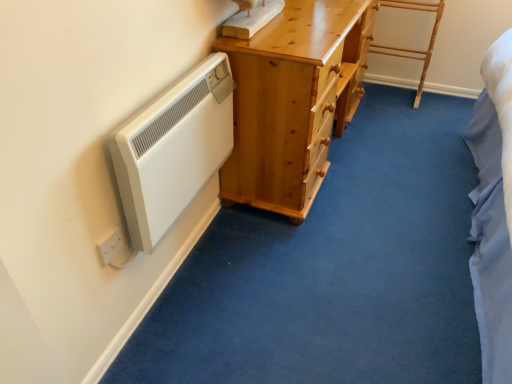
Question: Is light wood/rough textured ladder at upper right shorter than white matte radiator at left?

Choices:
 (A) yes
 (B) no

Answer: (B)

Question: From a real-world perspective, is light wood/rough textured ladder at upper right below white matte radiator at left?

Choices:
 (A) yes
 (B) no

Answer: (A)

Question: From a real-world perspective, is light wood/rough textured ladder at upper right on white matte radiator at left?

Choices:
 (A) yes
 (B) no

Answer: (B)

Question: Considering the relative sizes of light wood/rough textured ladder at upper right and white matte radiator at left in the image provided, is light wood/rough textured ladder at upper right bigger than white matte radiator at left?

Choices:
 (A) yes
 (B) no

Answer: (A)

Question: From the image's perspective, would you say light wood/rough textured ladder at upper right is shown under white matte radiator at left?

Choices:
 (A) yes
 (B) no

Answer: (B)

Question: From the image's perspective, relative to light wood/rough textured ladder at upper right, is white matte radiator at left above or below?

Choices:
 (A) below
 (B) above

Answer: (A)

Question: Do you think white matte radiator at left is within light wood/rough textured ladder at upper right, or outside of it?

Choices:
 (A) outside
 (B) inside

Answer: (A)

Question: In the image, is white matte radiator at left positioned in front of or behind light wood/rough textured ladder at upper right?

Choices:
 (A) front
 (B) behind

Answer: (A)

Question: In terms of height, does white matte radiator at left look taller or shorter compared to light wood/rough textured ladder at upper right?

Choices:
 (A) tall
 (B) short

Answer: (B)

Question: Is light wood/rough textured ladder at upper right spatially inside white plastic electric outlet at lower left, or outside of it?

Choices:
 (A) outside
 (B) inside

Answer: (A)

Question: In terms of width, does light wood/rough textured ladder at upper right look wider or thinner when compared to white plastic electric outlet at lower left?

Choices:
 (A) wide
 (B) thin

Answer: (A)

Question: Is light wood/rough textured ladder at upper right taller or shorter than white plastic electric outlet at lower left?

Choices:
 (A) tall
 (B) short

Answer: (A)

Question: From the image's perspective, relative to white plastic electric outlet at lower left, is light wood/rough textured ladder at upper right above or below?

Choices:
 (A) below
 (B) above

Answer: (B)

Question: In terms of height, does light wood/rough textured ladder at upper right look taller or shorter compared to white matte radiator at left?

Choices:
 (A) short
 (B) tall

Answer: (B)

Question: Is light wood/rough textured ladder at upper right in front of or behind white matte radiator at left in the image?

Choices:
 (A) behind
 (B) front

Answer: (A)